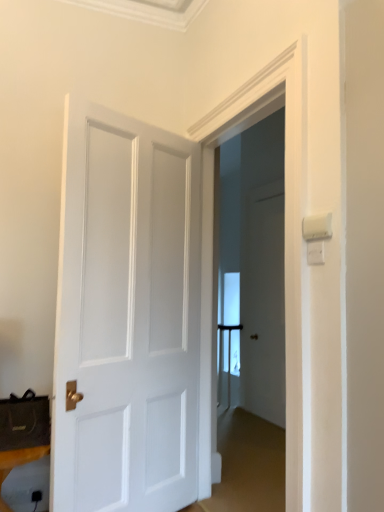
Question: Considering the positions of black plastic speaker at lower left and white matte door at center in the image, is black plastic speaker at lower left wider or thinner than white matte door at center?

Choices:
 (A) wide
 (B) thin

Answer: (A)

Question: In the image, is black plastic speaker at lower left on the left side or the right side of white matte door at center?

Choices:
 (A) right
 (B) left

Answer: (B)

Question: From a real-world perspective, is black plastic speaker at lower left above or below white matte door at center?

Choices:
 (A) below
 (B) above

Answer: (A)

Question: Do you think white matte door at center is within black plastic speaker at lower left, or outside of it?

Choices:
 (A) outside
 (B) inside

Answer: (A)

Question: Relative to black plastic speaker at lower left, is white matte door at center in front or behind?

Choices:
 (A) front
 (B) behind

Answer: (B)

Question: From a real-world perspective, is white matte door at center above or below black plastic speaker at lower left?

Choices:
 (A) below
 (B) above

Answer: (B)

Question: From the image's perspective, is white matte door at center positioned above or below black plastic speaker at lower left?

Choices:
 (A) above
 (B) below

Answer: (A)